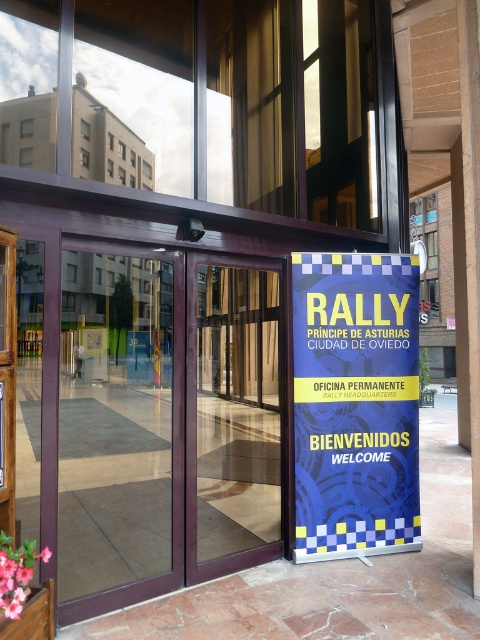
Based on the photo, you are standing at the entrance of the building and want to locate the transparent glass door at center. According to the coordinates provided, where exactly is it positioned?

The transparent glass door at center is positioned at point coordinates of 0.666 on the x axis and 0.250 on the y axis.